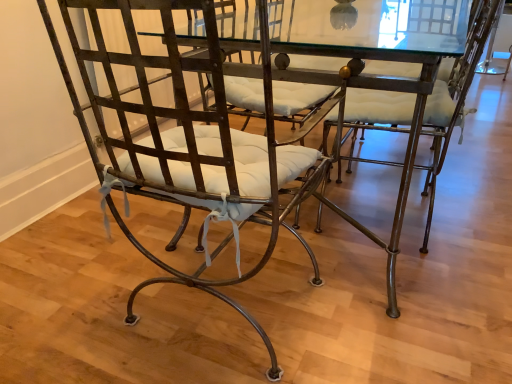
Question: From a real-world perspective, is matte metal chair at center, the second chair viewed from the left, below matte metal chair at center, which ranks as the second chair in right-to-left order?

Choices:
 (A) yes
 (B) no

Answer: (A)

Question: Is matte metal chair at center, the second chair viewed from the left, oriented away from matte metal chair at center, which ranks as the second chair in right-to-left order?

Choices:
 (A) no
 (B) yes

Answer: (A)

Question: From a real-world perspective, is matte metal chair at center, the second chair viewed from the left, positioned over matte metal chair at center, which appears as the 1th chair when viewed from the left, based on gravity?

Choices:
 (A) no
 (B) yes

Answer: (A)

Question: Can you confirm if matte metal chair at center, placed as the first chair when sorted from right to left, is positioned to the left of matte metal chair at center, which appears as the 1th chair when viewed from the left?

Choices:
 (A) yes
 (B) no

Answer: (B)

Question: Is matte metal chair at center, which appears as the 1th chair when viewed from the left, located within matte metal chair at center, the second chair viewed from the left?

Choices:
 (A) yes
 (B) no

Answer: (B)

Question: Would you say matte metal chair at center, the second chair viewed from the left, is a long distance from matte metal chair at center, which appears as the 1th chair when viewed from the left?

Choices:
 (A) yes
 (B) no

Answer: (B)

Question: Considering the relative sizes of matte metal chair at center, the second chair viewed from the left, and glass transparent table at center in the image provided, is matte metal chair at center, the second chair viewed from the left, taller than glass transparent table at center?

Choices:
 (A) yes
 (B) no

Answer: (A)

Question: Is matte metal chair at center, the second chair viewed from the left, facing towards glass transparent table at center?

Choices:
 (A) yes
 (B) no

Answer: (A)

Question: Is matte metal chair at center, placed as the first chair when sorted from right to left, outside of glass transparent table at center?

Choices:
 (A) no
 (B) yes

Answer: (A)

Question: Considering the relative positions of matte metal chair at center, the second chair viewed from the left, and glass transparent table at center in the image provided, is matte metal chair at center, the second chair viewed from the left, to the left of glass transparent table at center from the viewer's perspective?

Choices:
 (A) no
 (B) yes

Answer: (A)

Question: Is matte metal chair at center, the second chair viewed from the left, further to camera compared to glass transparent table at center?

Choices:
 (A) yes
 (B) no

Answer: (A)

Question: From the image's perspective, is matte metal chair at center, the second chair viewed from the left, below glass transparent table at center?

Choices:
 (A) no
 (B) yes

Answer: (B)

Question: From the image's perspective, does matte metal chair at center, which ranks as the second chair in right-to-left order, appear higher than matte metal chair at center, the second chair viewed from the left?

Choices:
 (A) yes
 (B) no

Answer: (B)